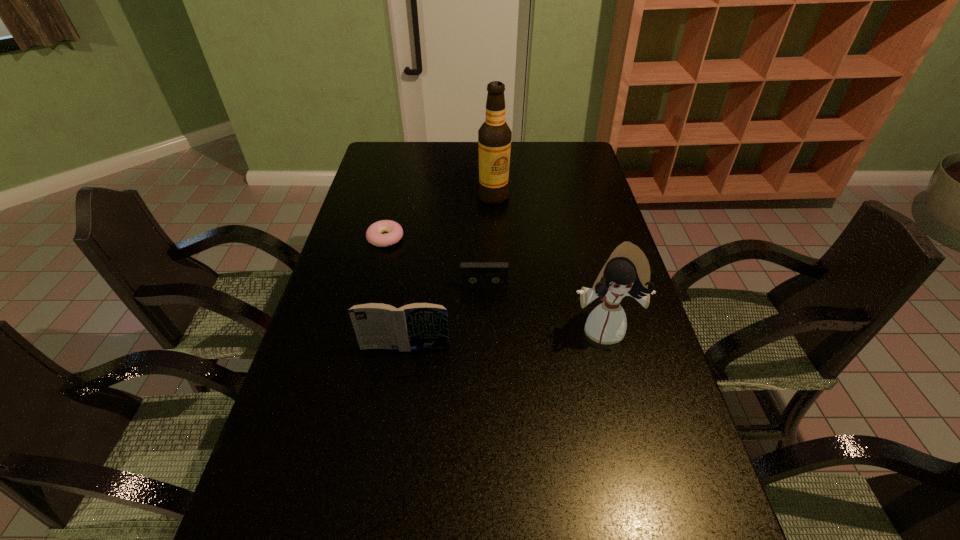
Locate which object is the second closest to the doughnut. Please provide its 2D coordinates. Your answer should be formatted as a tuple, i.e. [(x, y)], where the tuple contains the x and y coordinates of a point satisfying the conditions above.

[(494, 136)]

Locate which object ranks third in proximity to the alcohol. Please provide its 2D coordinates. Your answer should be formatted as a tuple, i.e. [(x, y)], where the tuple contains the x and y coordinates of a point satisfying the conditions above.

[(627, 272)]